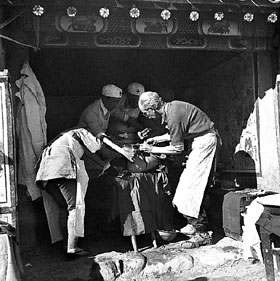
Locate an element on the screen. The image size is (280, 281). table legs is located at coordinates (154, 246), (133, 246).